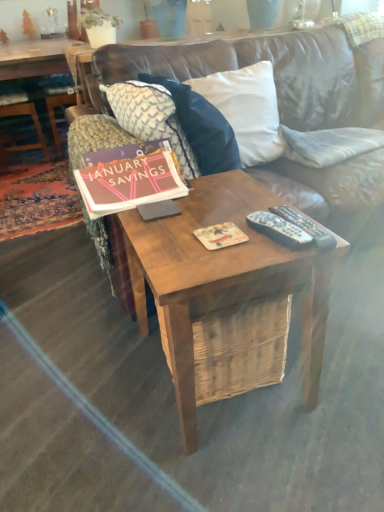
Identify the location of free space in front of wooden table at center. This screenshot has height=512, width=384. (241, 469).